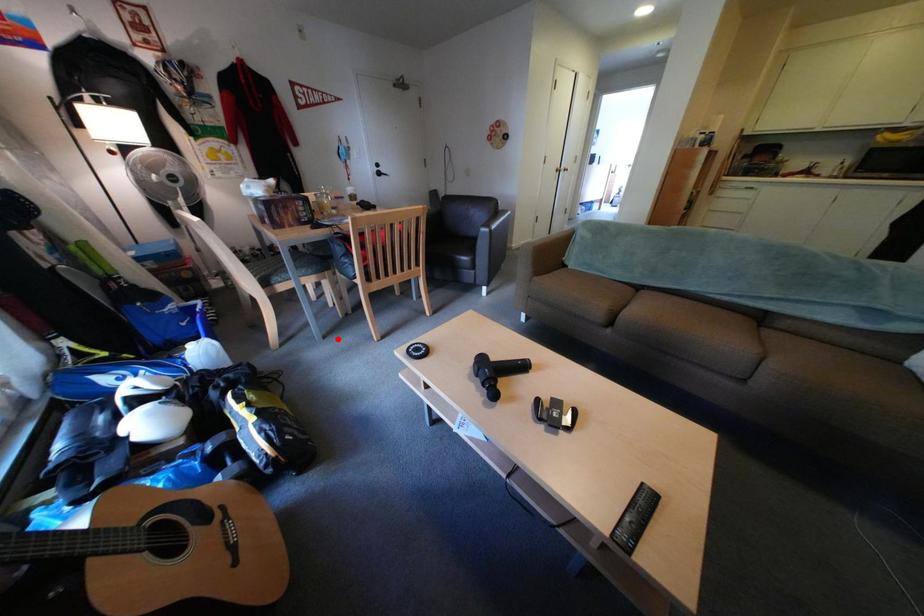
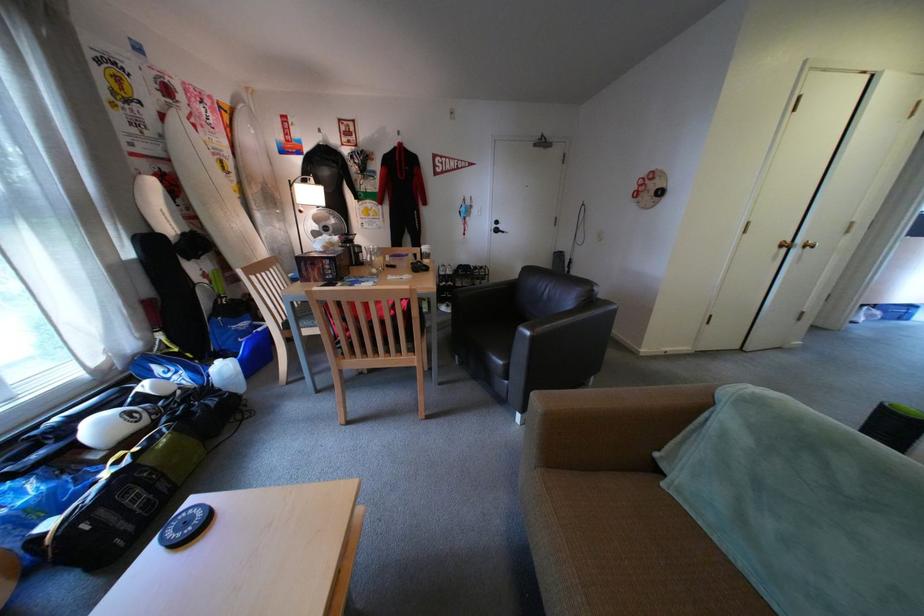
Question: I am providing you with two images of the same scene from different viewpoints. A red point is shown in image1. For the corresponding object point in image2, is it positioned nearer or farther from the camera?

Choices:
 (A) Nearer
 (B) Farther

Answer: (A)